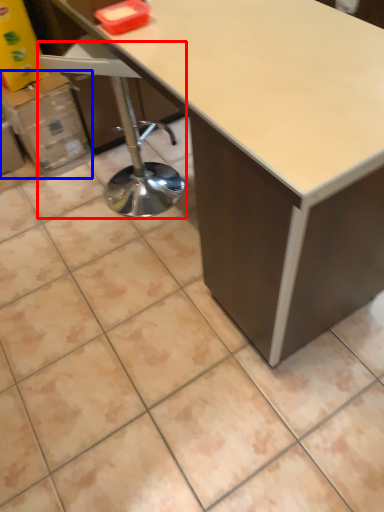
Question: Which point is further to the camera, swivel chair (highlighted by a red box) or cardboard box (highlighted by a blue box)?

Choices:
 (A) swivel chair
 (B) cardboard box

Answer: (B)